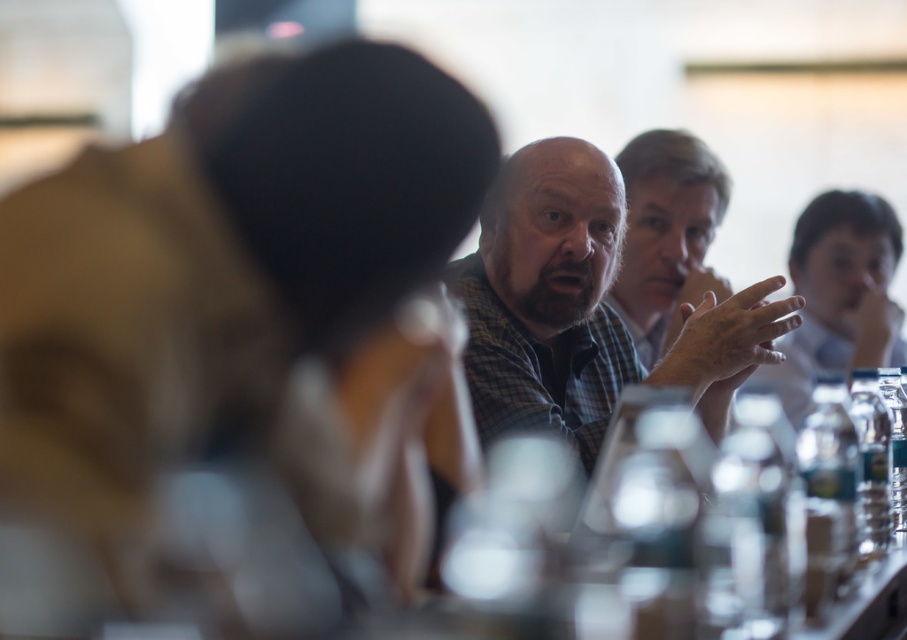
You are attending a virtual meeting and notice two shirts at the center of the screen. Which one is positioned lower between the plaid shirt at center and the checkered fabric shirt at center?

The plaid shirt at center is positioned lower than the checkered fabric shirt at center.

Where is the plaid shirt at center located in the image?

The plaid shirt at center is located at point (583, 307).

Consider the image. You are organizing a charity event and need to decide which shirt to donate between the plaid shirt at center and the checkered fabric shirt at center. Based on their sizes, which one would you choose to donate if you prefer donating larger clothing items?

The plaid shirt at center has a larger size compared to the checkered fabric shirt at center, so you should donate the plaid shirt at center.